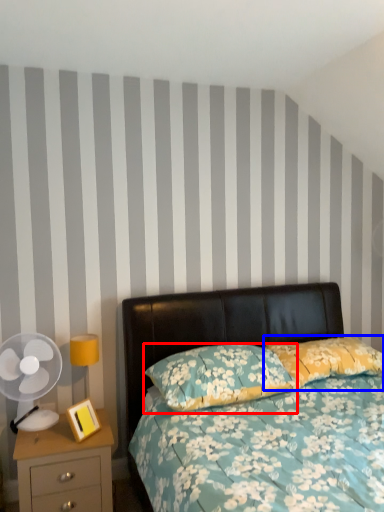
Question: Which object is closer to the camera taking this photo, pillow (highlighted by a red box) or pillow (highlighted by a blue box)?

Choices:
 (A) pillow
 (B) pillow

Answer: (A)